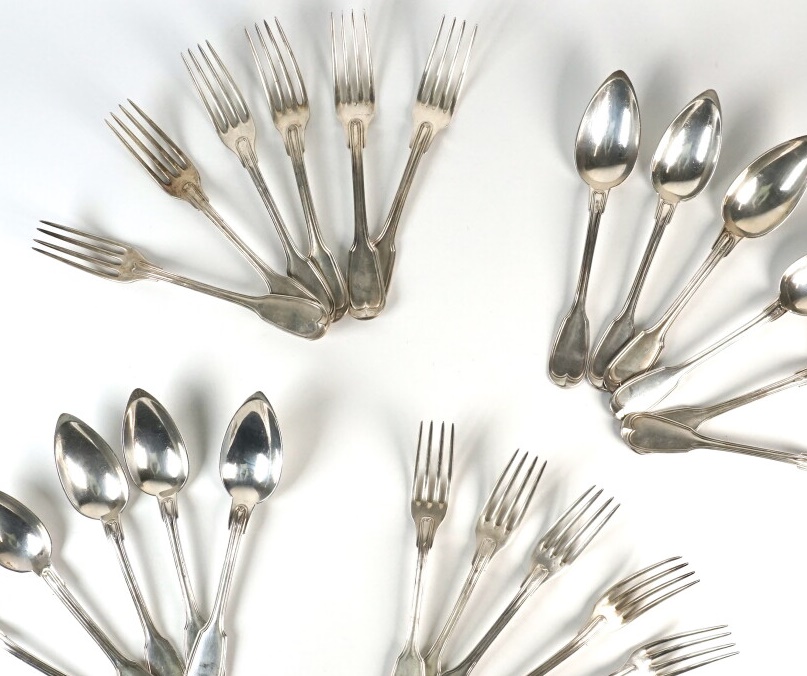
In order to click on silverware on the upper half of the image in this screenshot , I will do `click(109, 247)`, `click(174, 170)`, `click(241, 122)`, `click(297, 116)`, `click(352, 112)`, `click(429, 103)`, `click(588, 153)`, `click(676, 172)`, `click(757, 195)`, `click(789, 270)`.